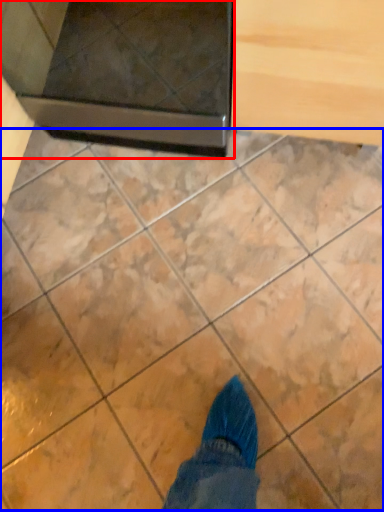
Question: Which of the following is the closest to the observer, appliance (highlighted by a red box) or marble (highlighted by a blue box)?

Choices:
 (A) appliance
 (B) marble

Answer: (A)